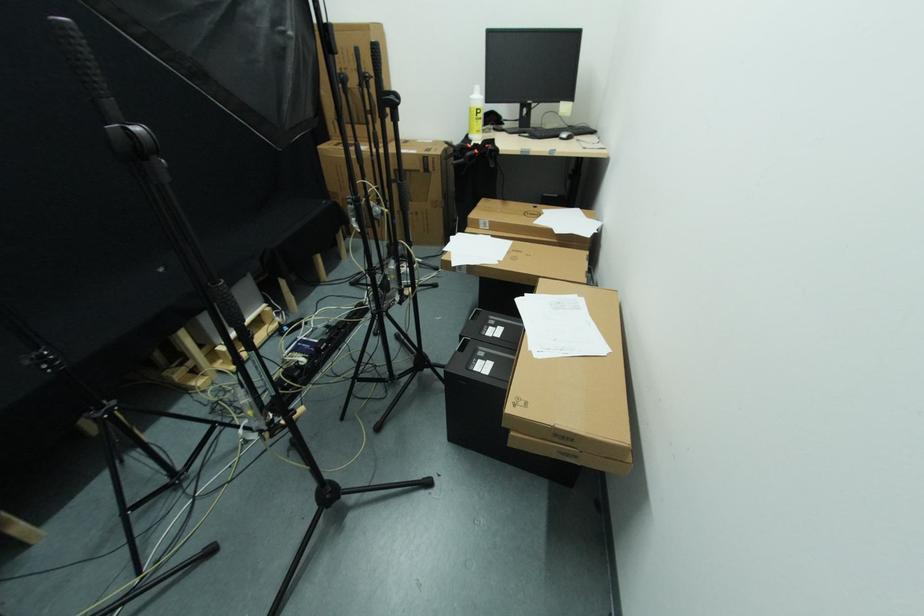
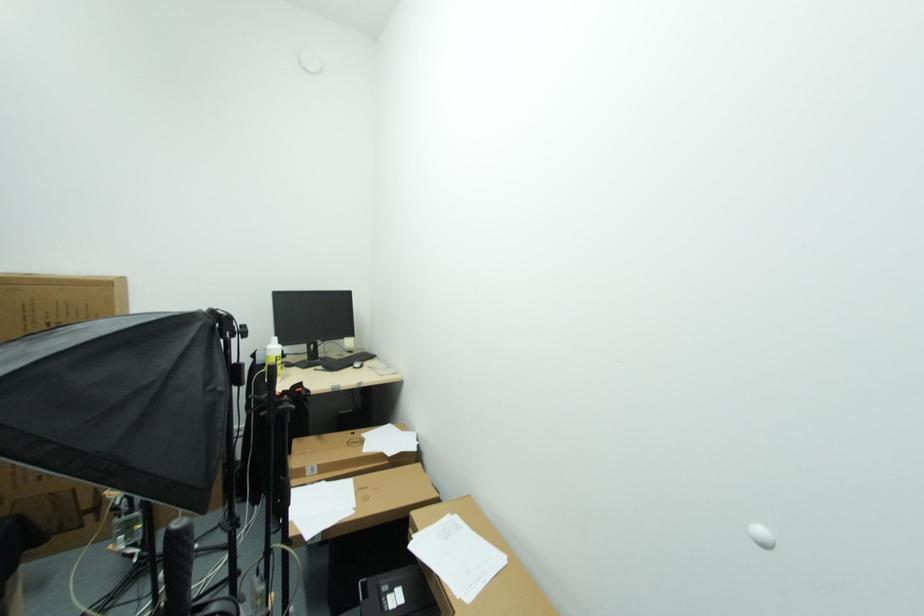
In the second image, find the point that corresponds to (525,298) in the first image.

(414, 541)